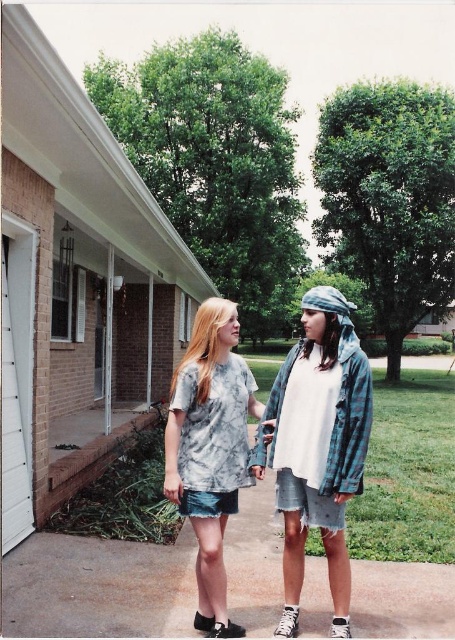
Question: From the image, what is the correct spatial relationship of concrete pavement at lower center in relation to tie-dye t-shirt at center?

Choices:
 (A) below
 (B) above

Answer: (A)

Question: Which point is closer to the camera?

Choices:
 (A) concrete pavement at lower center
 (B) tie-dye fabric shirt at center

Answer: (B)

Question: Which of the following is the farthest from the observer?

Choices:
 (A) tie-dye fabric shirt at center
 (B) concrete pavement at lower center
 (C) tie-dye t-shirt at center

Answer: (B)

Question: From the image, what is the correct spatial relationship of concrete pavement at lower center in relation to tie-dye t-shirt at center?

Choices:
 (A) right
 (B) left

Answer: (B)

Question: In this image, where is tie-dye t-shirt at center located relative to tie-dye fabric shirt at center?

Choices:
 (A) above
 (B) below

Answer: (B)

Question: Which of the following is the farthest from the observer?

Choices:
 (A) (288, 419)
 (B) (264, 580)

Answer: (B)